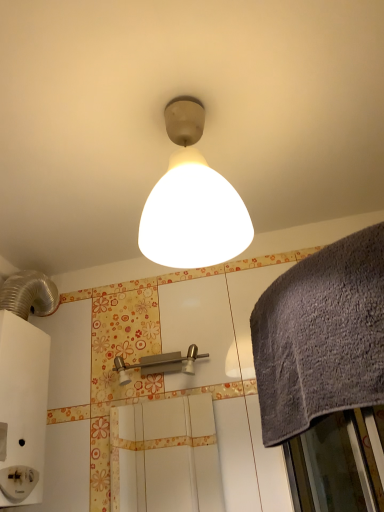
Question: Can you confirm if white matte screen door at center is thinner than matte white lampshade at center?

Choices:
 (A) no
 (B) yes

Answer: (B)

Question: Can you confirm if white matte screen door at center is bigger than matte white lampshade at center?

Choices:
 (A) no
 (B) yes

Answer: (A)

Question: From a real-world perspective, is white matte screen door at center positioned under matte white lampshade at center based on gravity?

Choices:
 (A) no
 (B) yes

Answer: (B)

Question: Is white matte screen door at center shorter than matte white lampshade at center?

Choices:
 (A) yes
 (B) no

Answer: (A)

Question: Is white matte screen door at center positioned far away from matte white lampshade at center?

Choices:
 (A) no
 (B) yes

Answer: (B)

Question: In terms of size, does matte white lampshade at center appear bigger or smaller than gray textured towel at right?

Choices:
 (A) big
 (B) small

Answer: (B)

Question: From the image's perspective, relative to gray textured towel at right, is matte white lampshade at center above or below?

Choices:
 (A) above
 (B) below

Answer: (A)

Question: Visually, is matte white lampshade at center positioned to the left or to the right of gray textured towel at right?

Choices:
 (A) left
 (B) right

Answer: (A)

Question: Is matte white lampshade at center taller or shorter than gray textured towel at right?

Choices:
 (A) short
 (B) tall

Answer: (B)

Question: Relative to brushed metal shower at center, is matte white lampshade at center in front or behind?

Choices:
 (A) behind
 (B) front

Answer: (B)

Question: From a real-world perspective, is matte white lampshade at center positioned above or below brushed metal shower at center?

Choices:
 (A) above
 (B) below

Answer: (A)

Question: Visually, is matte white lampshade at center positioned to the left or to the right of brushed metal shower at center?

Choices:
 (A) right
 (B) left

Answer: (A)

Question: From the image's perspective, is matte white lampshade at center positioned above or below brushed metal shower at center?

Choices:
 (A) above
 (B) below

Answer: (A)

Question: From a real-world perspective, relative to brushed metal shower at center, is gray textured towel at right vertically above or below?

Choices:
 (A) above
 (B) below

Answer: (B)

Question: Which is correct: gray textured towel at right is inside brushed metal shower at center, or outside of it?

Choices:
 (A) inside
 (B) outside

Answer: (B)